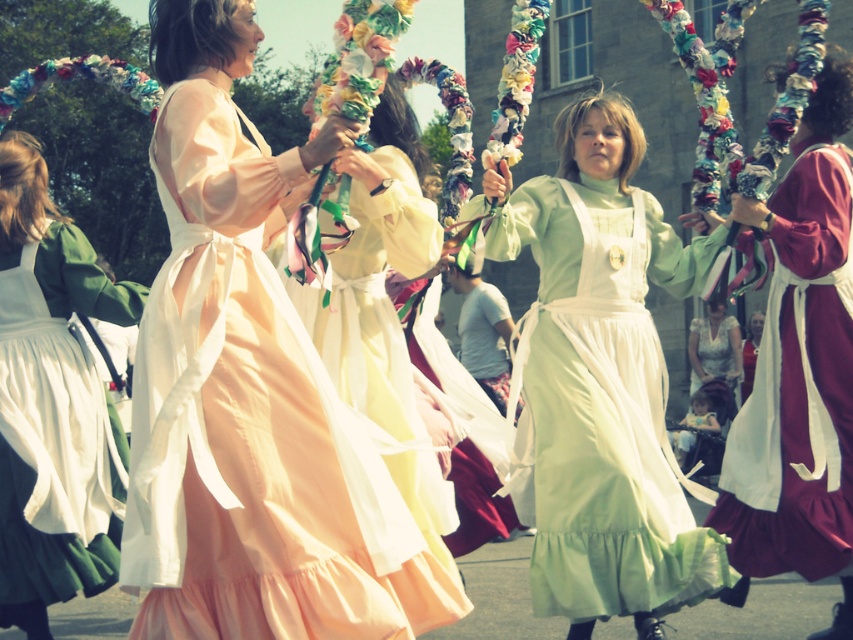
Between light green cotton dress at center and green satin dress at left, which one is positioned higher?

green satin dress at left is higher up.

Does light green cotton dress at center have a larger size compared to green satin dress at left?

Actually, light green cotton dress at center might be smaller than green satin dress at left.

Where is `light green cotton dress at center`? The width and height of the screenshot is (853, 640). light green cotton dress at center is located at coordinates (601, 403).

Identify the location of light pink satin dress at center. click(x=253, y=426).

Does point (347, 605) come behind point (828, 97)?

No.

Identify the location of light pink satin dress at center. (253, 426).

Who is more distant from viewer, [242,140] or [579,586]?

The point [579,586] is more distant.

Is point (173, 316) behind point (540, 506)?

No, it is in front of (540, 506).

In order to click on light pink satin dress at center in this screenshot , I will do `click(253, 426)`.